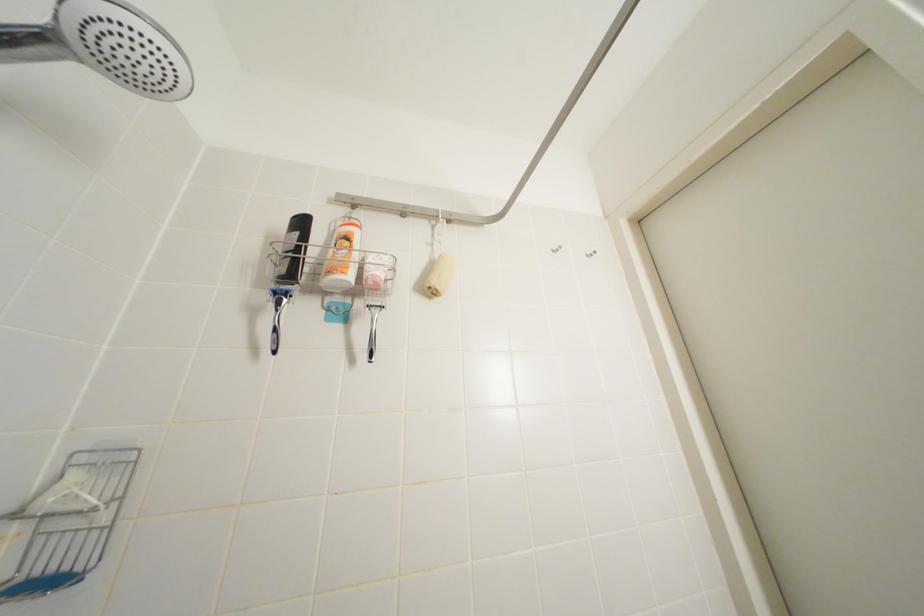
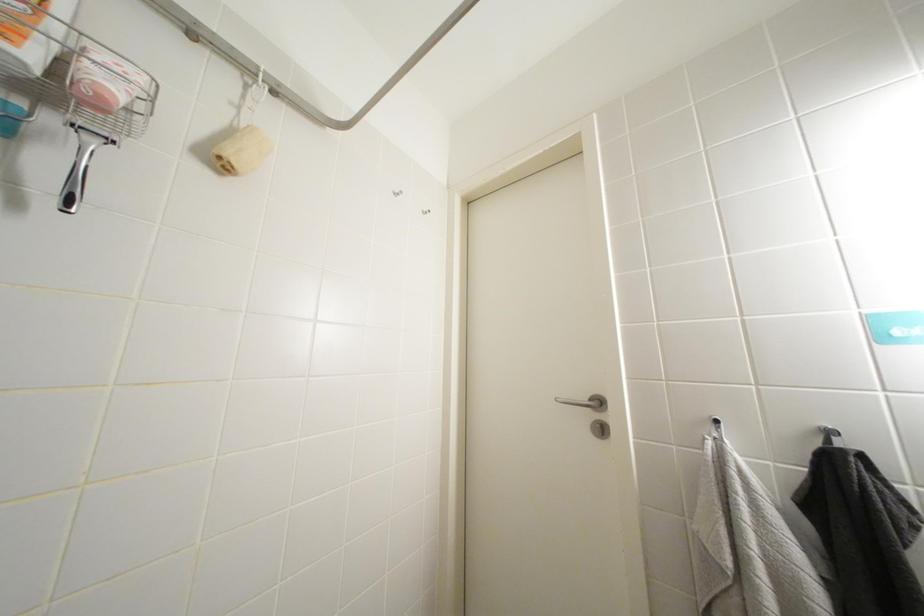
Question: The first image is from the beginning of the video and the second image is from the end. How did the camera likely rotate when shooting the video?

Choices:
 (A) Left
 (B) Right
 (C) Up
 (D) Down

Answer: (B)